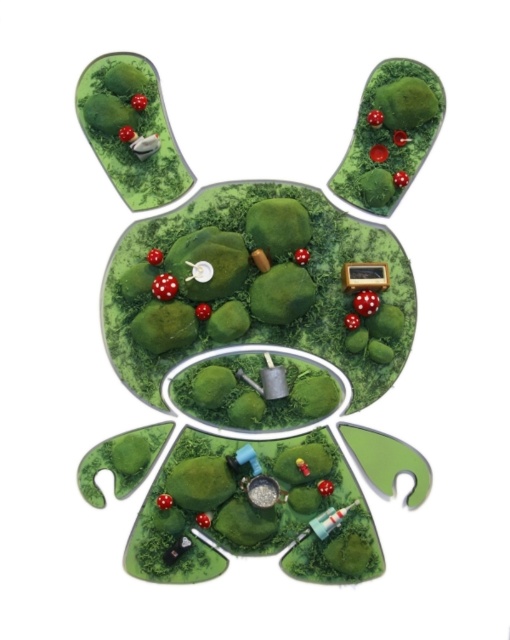
The image size is (510, 640). I want to click on matte white mushroom at upper left, so click(x=131, y=129).

Can you confirm if matte white mushroom at upper left is positioned below matte green mushroom at upper right?

Actually, matte white mushroom at upper left is above matte green mushroom at upper right.

Who is more distant from viewer, (167, 193) or (380, 125)?

Point (167, 193)

The height and width of the screenshot is (640, 510). I want to click on matte white mushroom at upper left, so click(x=131, y=129).